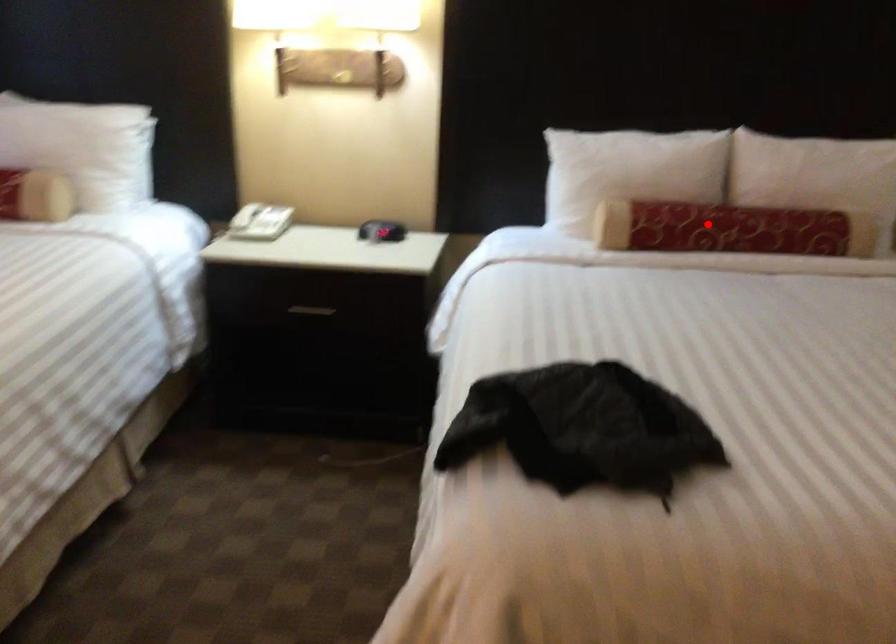
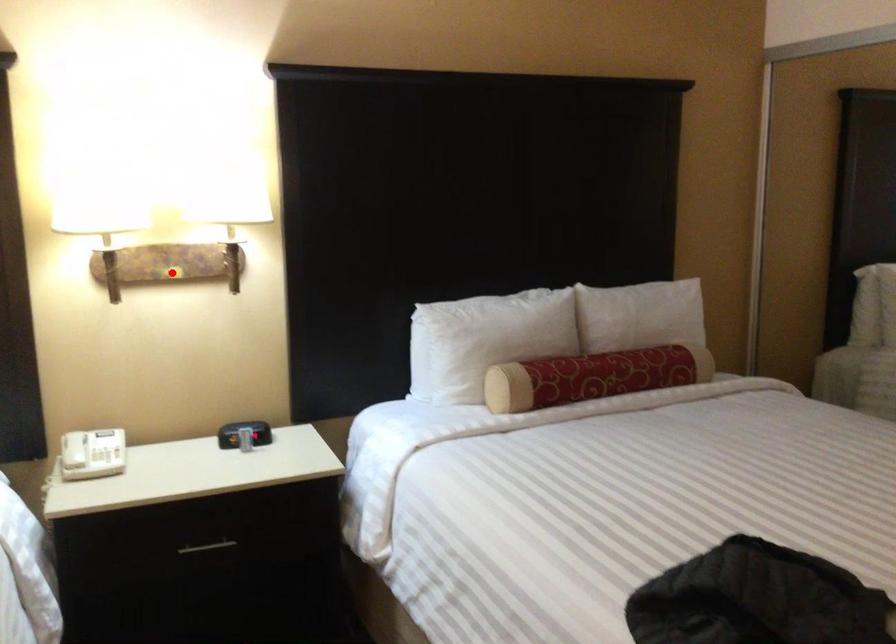
I am providing you with two images of the same scene from different viewpoints. A red point is marked on the first image and another point is marked on the second image. Do the highlighted points in image1 and image2 indicate the same real-world spot?

No